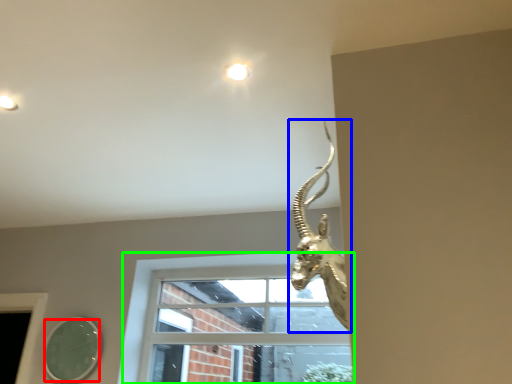
Question: Considering the real-world distances, which object is farthest from mirror (highlighted by a red box)? animal (highlighted by a blue box) or window (highlighted by a green box)?

Choices:
 (A) animal
 (B) window

Answer: (A)